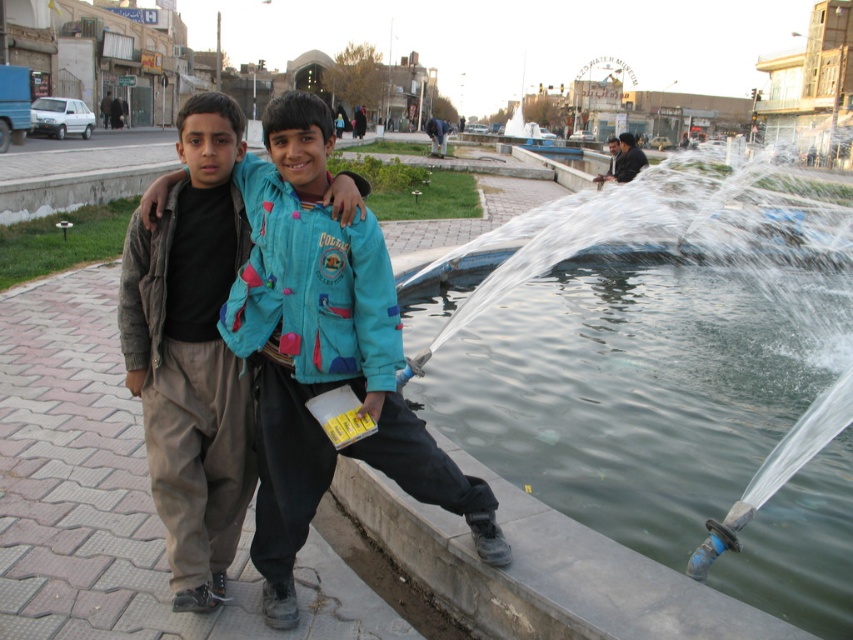
You are a photographer trying to capture both the clear plastic water at center right and the teal fabric jacket at center in a single shot. Based on their sizes, which object should you focus on first to ensure both are in frame?

The clear plastic water at center right is larger in size compared to the teal fabric jacket at center, so you should focus on the clear plastic water at center right first to ensure both fit in the frame.

You are a photographer trying to capture both the clear plastic water at center right and the teal fabric jacket at center in the same frame. Based on their positions, which object would appear larger in the photo?

The clear plastic water at center right appears larger in the photo because it is much taller than the teal fabric jacket at center.

You are a photographer trying to capture the boy in the teal fabric jacket at center without including the clear plastic water at center right in the frame. Is this possible based on their positions?

The clear plastic water at center right is positioned over the teal fabric jacket at center, so it would block the view. Therefore, it is not possible to capture the teal fabric jacket at center without including the clear plastic water at center right in the frame.